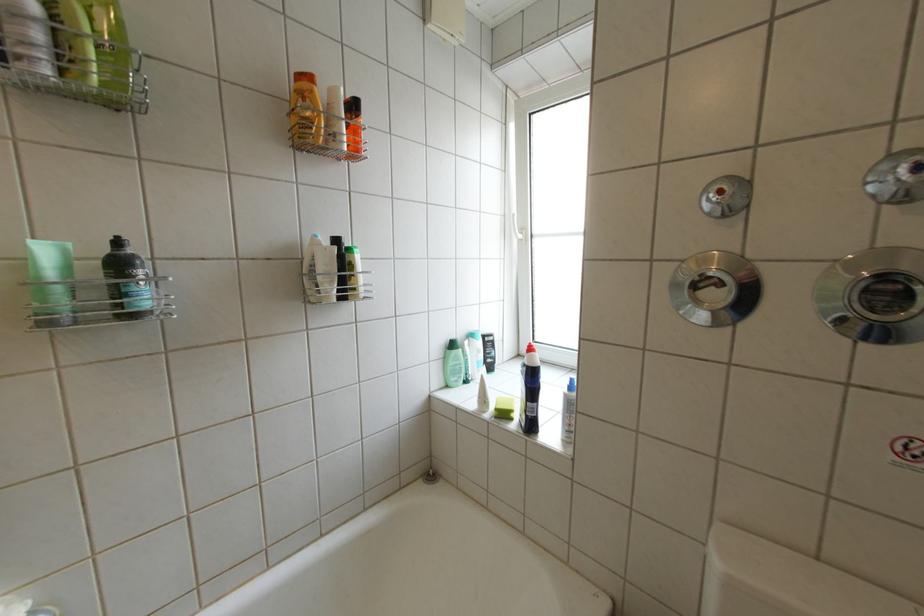
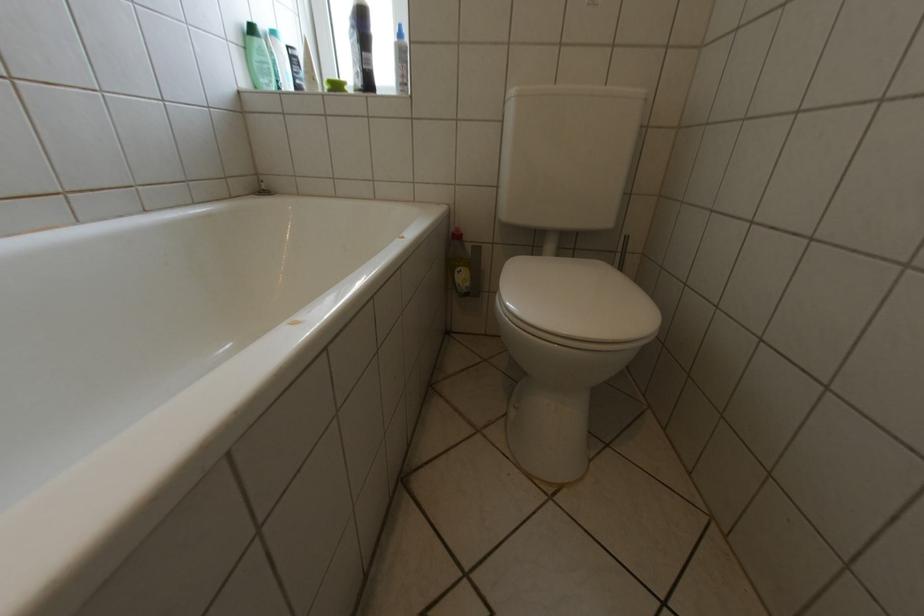
Find the pixel in the second image that matches point 464,363 in the first image.

(268, 59)